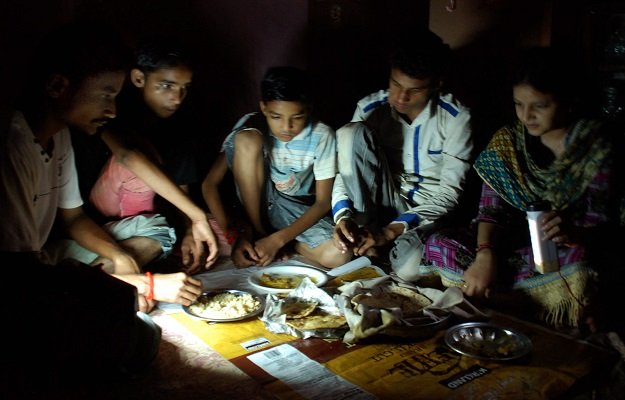
Identify the location of plates. (239, 305), (286, 278), (482, 343), (382, 297).